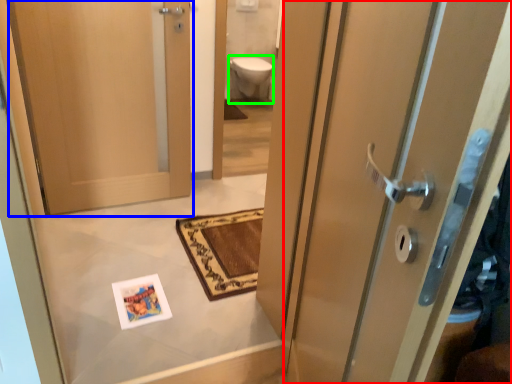
Question: Which object is positioned closest to door (highlighted by a red box)? Select from door (highlighted by a blue box) and toilet bowl (highlighted by a green box).

Choices:
 (A) door
 (B) toilet bowl

Answer: (A)